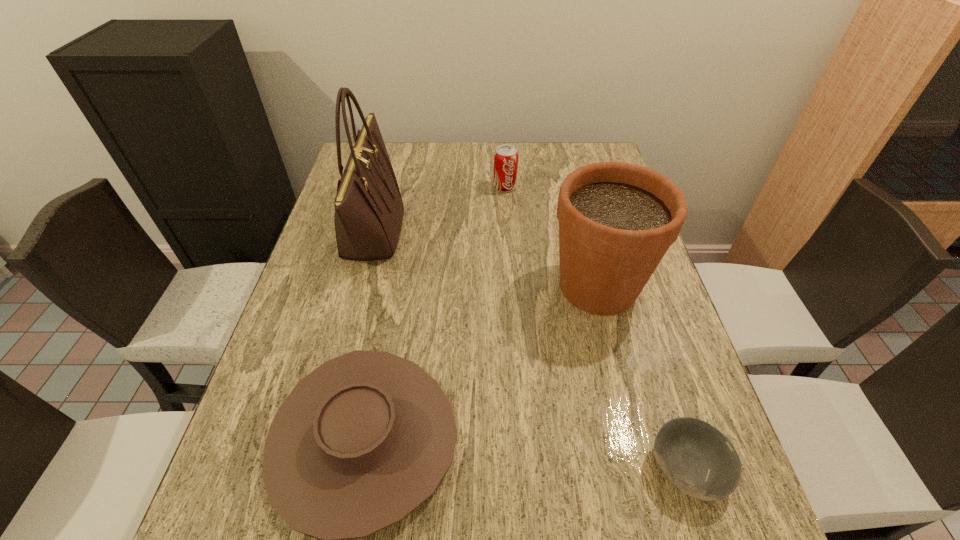
In order to click on the tallest object in this screenshot , I will do `click(369, 210)`.

Locate an element on the screen. the second tallest object is located at coordinates (617, 220).

You are a GUI agent. You are given a task and a screenshot of the screen. Output one action in this format:
    pyautogui.click(x=<x>, y=<y>)
    Task: Click on the soda can
    The width and height of the screenshot is (960, 540).
    Given the screenshot: What is the action you would take?
    [506, 156]

Identify the location of the third shortest object. (506, 156).

This screenshot has height=540, width=960. What are the coordinates of `the shortest object` in the screenshot? It's located at (699, 460).

Identify the location of free location located 0.270m on the front-facing side of the tallest object. This screenshot has width=960, height=540. (497, 231).

Where is `free space located 0.270m on the left of the fourth shortest object`? This screenshot has width=960, height=540. free space located 0.270m on the left of the fourth shortest object is located at coordinates (438, 286).

Image resolution: width=960 pixels, height=540 pixels. I want to click on free space located 0.270m on the right of the third object from right to left, so click(602, 187).

Locate an element on the screen. This screenshot has height=540, width=960. free space located on the left of the shortest object is located at coordinates (497, 468).

Image resolution: width=960 pixels, height=540 pixels. What are the coordinates of `object that is positioned at the far edge` in the screenshot? It's located at (506, 156).